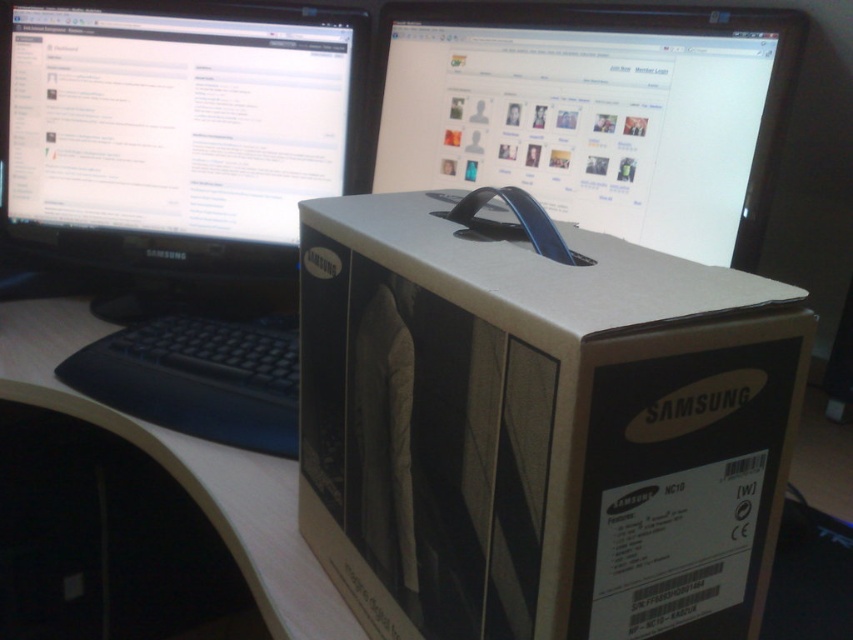
Question: Which of the following is the closest to the observer?

Choices:
 (A) (15, 236)
 (B) (352, 260)
 (C) (273, 323)

Answer: (B)

Question: Does matte black monitor at center appear over black plastic keyboard at lower left?

Choices:
 (A) no
 (B) yes

Answer: (B)

Question: Is matte black monitor at center bigger than black plastic keyboard at lower left?

Choices:
 (A) no
 (B) yes

Answer: (B)

Question: Is the position of black glossy monitor at upper left less distant than that of black plastic keyboard at lower left?

Choices:
 (A) yes
 (B) no

Answer: (B)

Question: Among these points, which one is farthest from the camera?

Choices:
 (A) (206, 412)
 (B) (165, 266)

Answer: (B)

Question: Which is nearer to the black glossy monitor at upper left?

Choices:
 (A) black plastic keyboard at lower left
 (B) matte black monitor at center

Answer: (A)